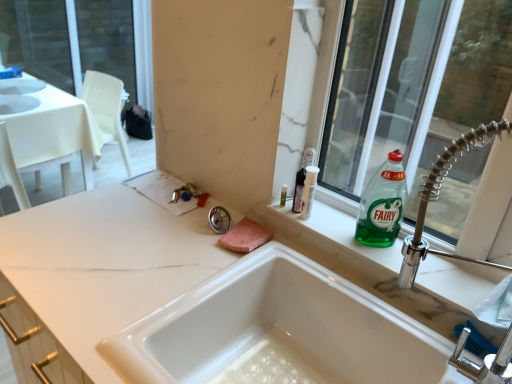
Identify the location of unoccupied region to the right of green glass bottle at upper right. (425, 257).